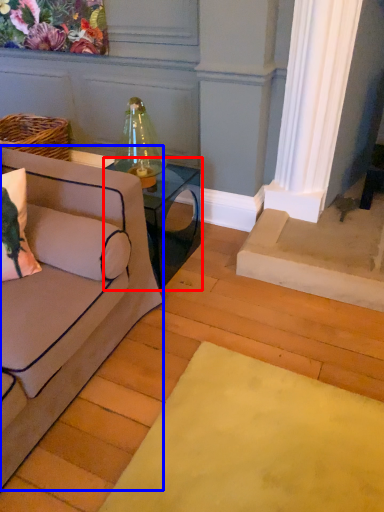
Question: Which of the following is the farthest to the observer, table (highlighted by a red box) or studio couch (highlighted by a blue box)?

Choices:
 (A) table
 (B) studio couch

Answer: (A)